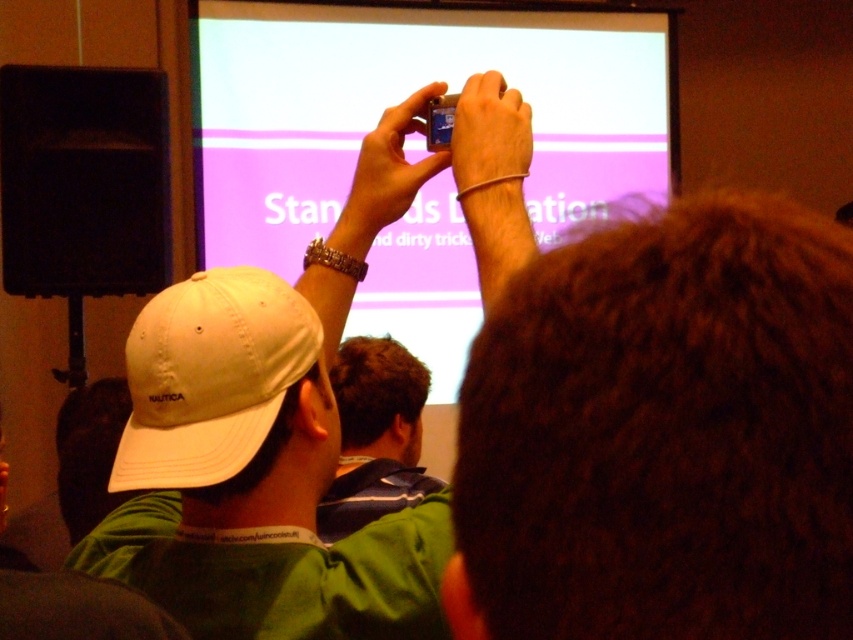
Question: Which object appears closest to the camera in this image?

Choices:
 (A) matte purple projector screen at upper center
 (B) black matte speaker at left
 (C) white fabric cap at upper left
 (D) white fabric baseball cap at left

Answer: (D)

Question: Does black matte speaker at left appear on the left side of white fabric baseball cap at left?

Choices:
 (A) yes
 (B) no

Answer: (A)

Question: Can you confirm if black matte speaker at left is wider than white fabric baseball cap at left?

Choices:
 (A) yes
 (B) no

Answer: (A)

Question: Which is nearer to the black matte speaker at left?

Choices:
 (A) matte purple projector screen at upper center
 (B) white fabric baseball cap at left
 (C) white fabric cap at upper left
 (D) dark brown hair at center

Answer: (A)

Question: Does white fabric baseball cap at left have a larger size compared to dark brown hair at center?

Choices:
 (A) no
 (B) yes

Answer: (A)

Question: Which of the following is the farthest from the observer?

Choices:
 (A) matte purple projector screen at upper center
 (B) black matte speaker at left
 (C) dark brown hair at center

Answer: (A)